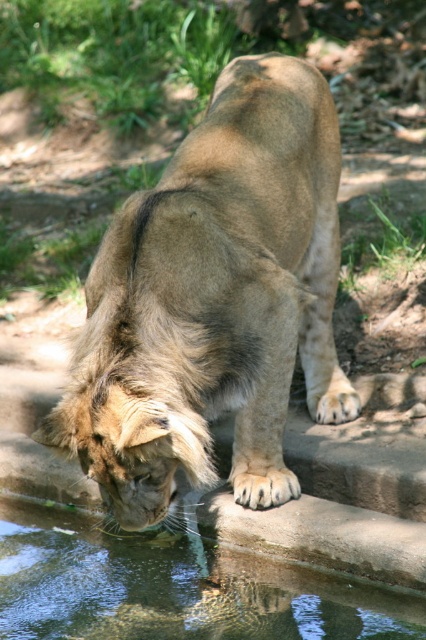
Does point (138, 460) come behind point (23, 576)?

No, it is in front of (23, 576).

Who is taller, golden fur lion at center or clear water at mouth?

golden fur lion at center is taller.

Locate an element on the screen. The width and height of the screenshot is (426, 640). golden fur lion at center is located at coordinates (213, 301).